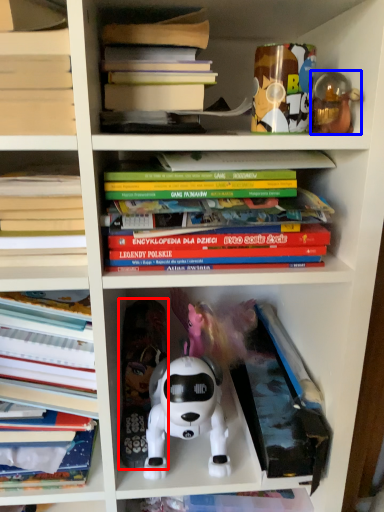
Question: Which object appears farthest to the camera in this image, toy (highlighted by a red box) or toy (highlighted by a blue box)?

Choices:
 (A) toy
 (B) toy

Answer: (A)